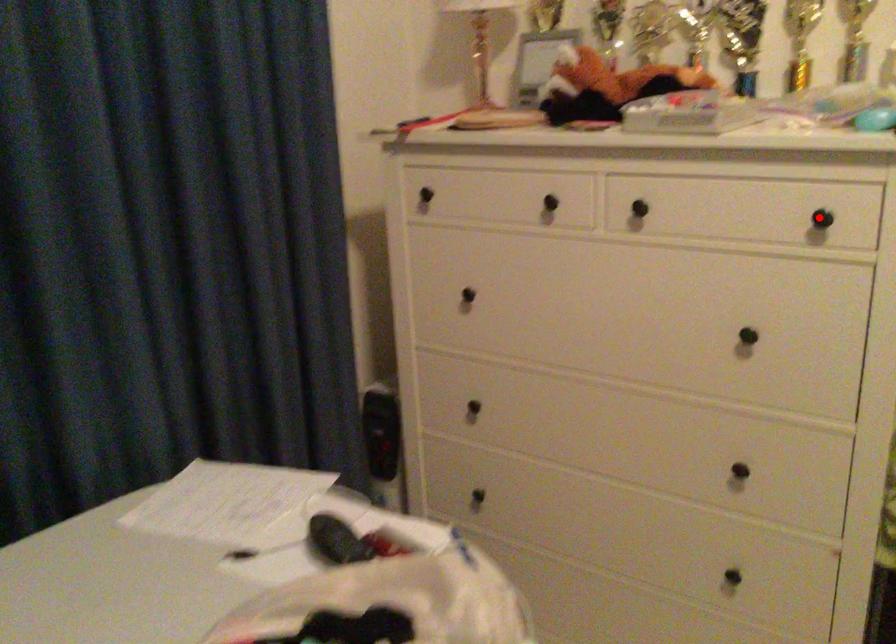
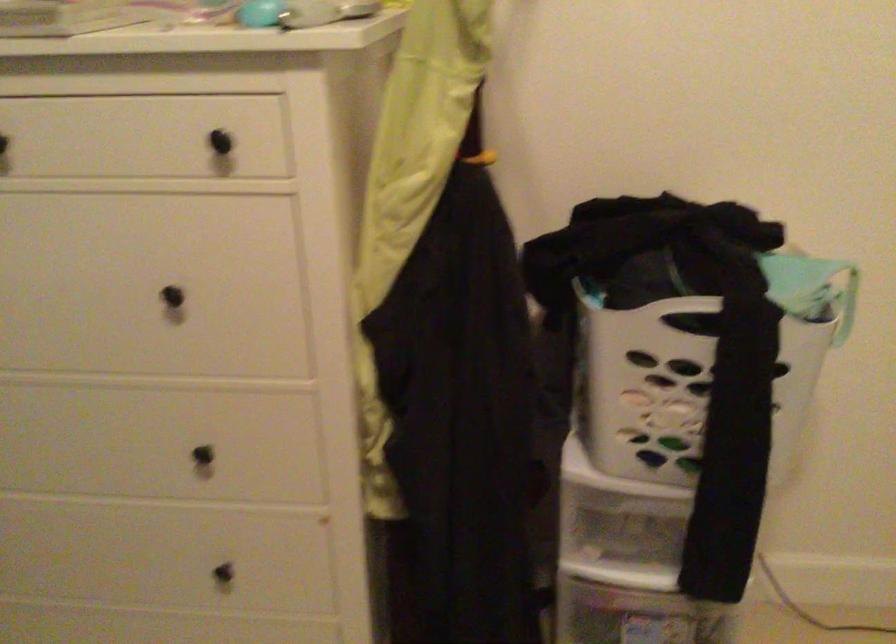
Locate, in the second image, the point that corresponds to the highlighted location in the first image.

(220, 142)